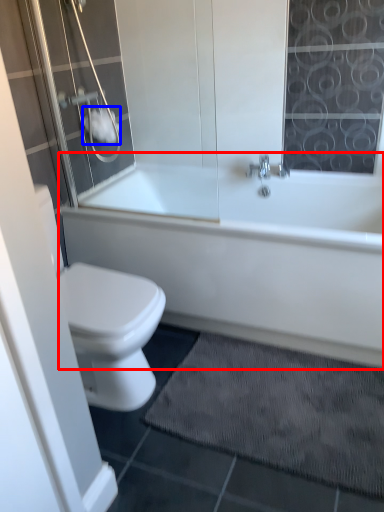
Question: Which of the following is the farthest to the observer, bathtub (highlighted by a red box) or toilet paper (highlighted by a blue box)?

Choices:
 (A) bathtub
 (B) toilet paper

Answer: (B)